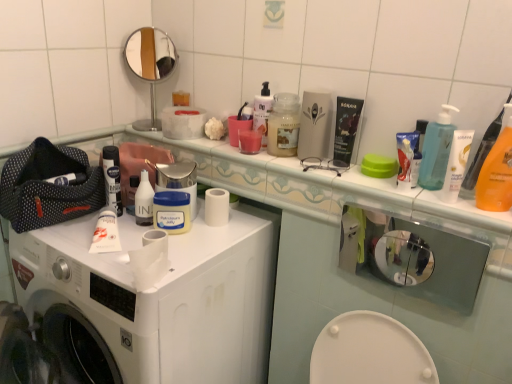
The height and width of the screenshot is (384, 512). What are the coordinates of `free spot to the right of white matte tube at center` in the screenshot? It's located at (169, 245).